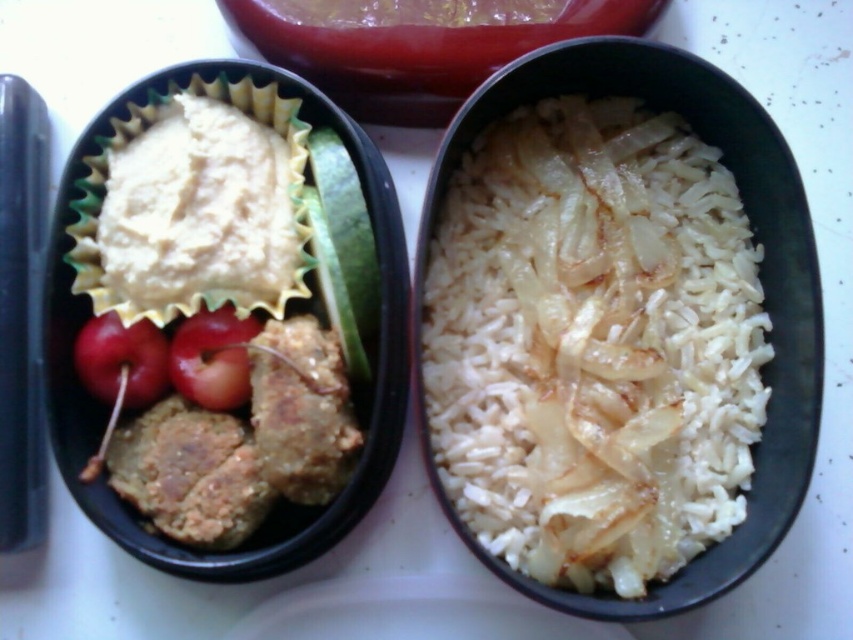
Question: Which point appears farthest from the camera in this image?

Choices:
 (A) (671, 141)
 (B) (113, 355)
 (C) (190, 342)

Answer: (A)

Question: Which point is closer to the camera taking this photo?

Choices:
 (A) (244, 324)
 (B) (606, 550)

Answer: (B)

Question: Does white matte rice at right have a larger size compared to red matte cherry at center?

Choices:
 (A) yes
 (B) no

Answer: (A)

Question: Is white matte rice at right wider than red shiny cherry at left?

Choices:
 (A) no
 (B) yes

Answer: (B)

Question: Among these objects, which one is farthest from the camera?

Choices:
 (A) red shiny cherry at left
 (B) white matte rice at right
 (C) red matte cherry at center

Answer: (C)

Question: Does red shiny cherry at left appear over red matte cherry at center?

Choices:
 (A) yes
 (B) no

Answer: (B)